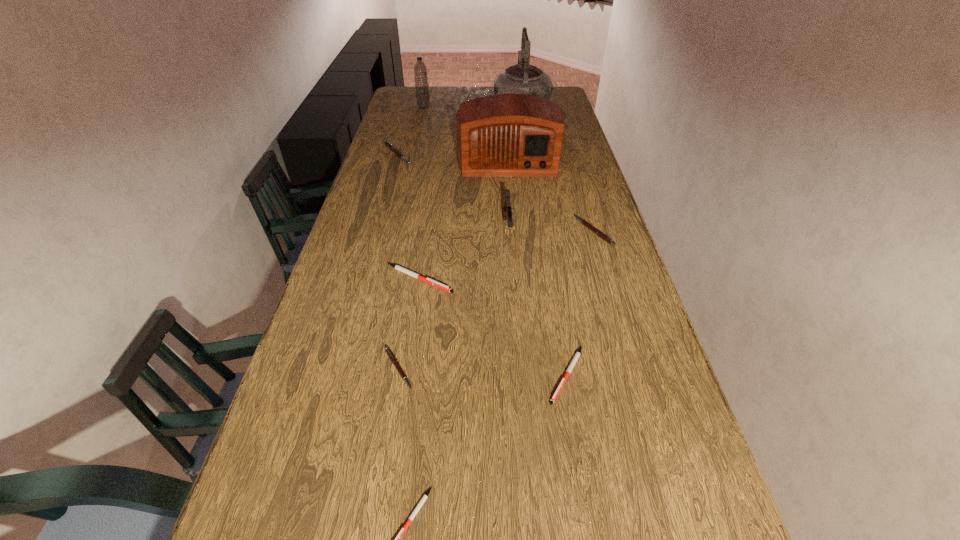
Image resolution: width=960 pixels, height=540 pixels. Find the location of `free region located 0.140m at the nib of the rightmost pen`. free region located 0.140m at the nib of the rightmost pen is located at coordinates (533, 232).

At what (x,y) coordinates should I click in order to perform the action: click on free space located at the nib of the rightmost pen. Please return your answer as a coordinate pair (x, y). The width and height of the screenshot is (960, 540). Looking at the image, I should click on (471, 232).

The height and width of the screenshot is (540, 960). Find the location of `vacant position located at the nib of the rightmost pen`. vacant position located at the nib of the rightmost pen is located at coordinates (466, 232).

Identify the location of free region located on the clicker of the biggest white pen. (556, 279).

Where is `free space located at the nib of the nearest pink pen`? This screenshot has width=960, height=540. free space located at the nib of the nearest pink pen is located at coordinates (464, 369).

Find the location of a particular element. vacant space located on the clicker of the rightmost white pen is located at coordinates (585, 483).

Image resolution: width=960 pixels, height=540 pixels. What are the coordinates of `kettle that is at the far edge` in the screenshot? It's located at (522, 78).

Identify the location of water bottle that is at the far edge. (420, 70).

What are the coordinates of `water bottle located in the left edge section of the desktop` in the screenshot? It's located at (420, 70).

In order to click on kettle located in the right edge section of the desktop in this screenshot , I will do `click(522, 78)`.